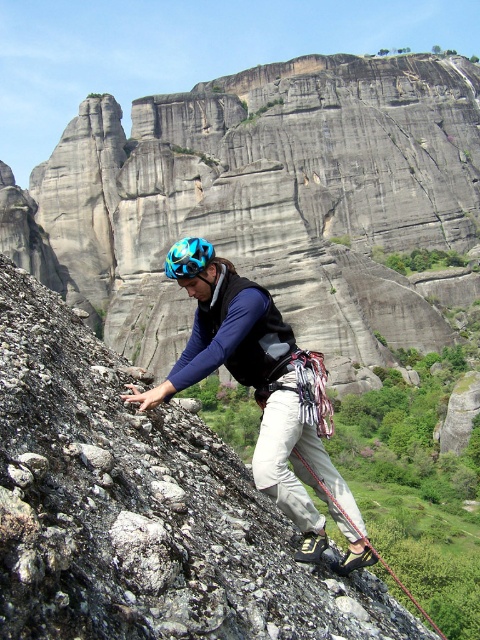
Between point (268, 490) and point (207, 241), which one is positioned in front?

Positioned in front is point (268, 490).

Is matte gray climbing harness at center to the left of shiny blue helmet at center from the viewer's perspective?

Incorrect, matte gray climbing harness at center is not on the left side of shiny blue helmet at center.

Is point (264, 296) positioned behind point (189, 268)?

Yes, point (264, 296) is farther from viewer.

Image resolution: width=480 pixels, height=640 pixels. I want to click on matte gray climbing harness at center, so click(264, 401).

In the scene shown: Does blue matte helmet at center have a lesser height compared to shiny blue helmet at center?

No.

Is blue matte helmet at center closer to the viewer compared to shiny blue helmet at center?

No, blue matte helmet at center is further to the viewer.

Where is `blue matte helmet at center`? blue matte helmet at center is located at coordinates (188, 257).

This screenshot has width=480, height=640. Identify the location of blue matte helmet at center. (188, 257).

Which of these two, matte gray climbing harness at center or blue matte helmet at center, stands shorter?

Standing shorter between the two is blue matte helmet at center.

Who is taller, matte gray climbing harness at center or blue matte helmet at center?

With more height is matte gray climbing harness at center.

Identify the location of matte gray climbing harness at center. The image size is (480, 640). (264, 401).